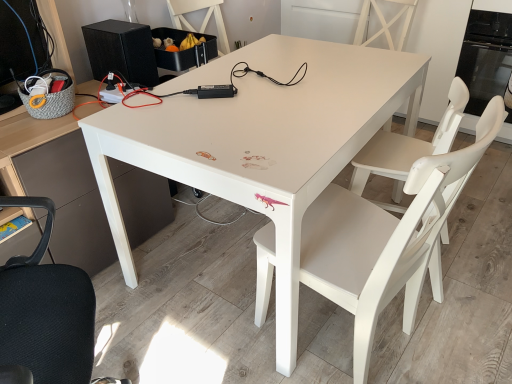
You are a GUI agent. You are given a task and a screenshot of the screen. Output one action in this format:
    pyautogui.click(x=<x>, y=<y>)
    Task: Click on the vacant space underneath white matte chair at center (from a real-world perspective)
    
    Given the screenshot: What is the action you would take?
    pyautogui.click(x=373, y=345)